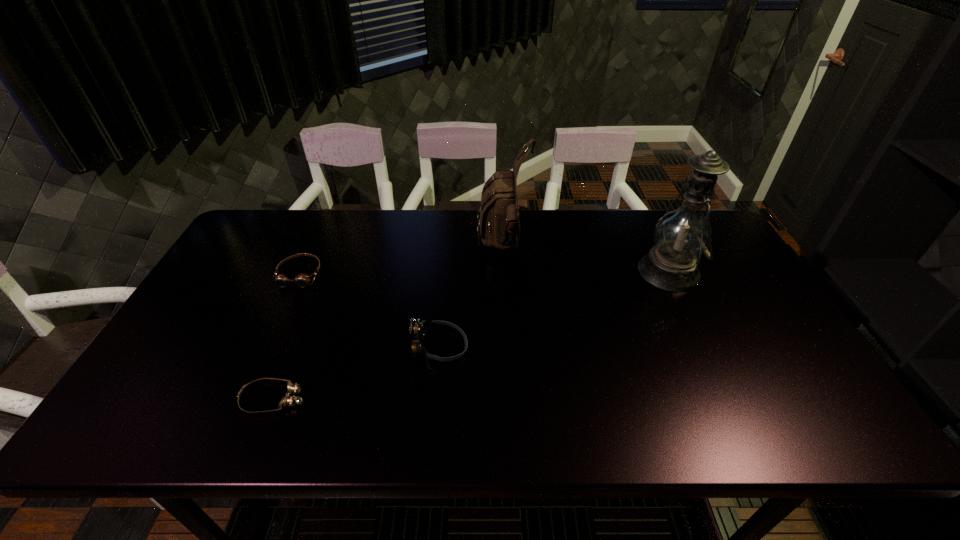
Identify the location of object that is at the right edge. (681, 236).

Locate an element on the screen. object that is at the far right corner is located at coordinates (681, 236).

Locate an element on the screen. vacant space at the far edge of the desktop is located at coordinates (574, 225).

I want to click on vacant space at the near edge, so pyautogui.click(x=698, y=415).

Where is `free location at the left edge`? free location at the left edge is located at coordinates point(226,273).

I want to click on vacant region at the right edge of the desktop, so click(764, 308).

I want to click on free space at the near right corner, so click(830, 408).

I want to click on free space between the shortest goggles and the fourth object from left to right, so click(389, 322).

Where is `free spot between the fourth farthest object and the fourth tallest object`? The image size is (960, 540). free spot between the fourth farthest object and the fourth tallest object is located at coordinates (370, 310).

Image resolution: width=960 pixels, height=540 pixels. I want to click on free spot between the fourth tallest object and the shoulder bag, so click(402, 260).